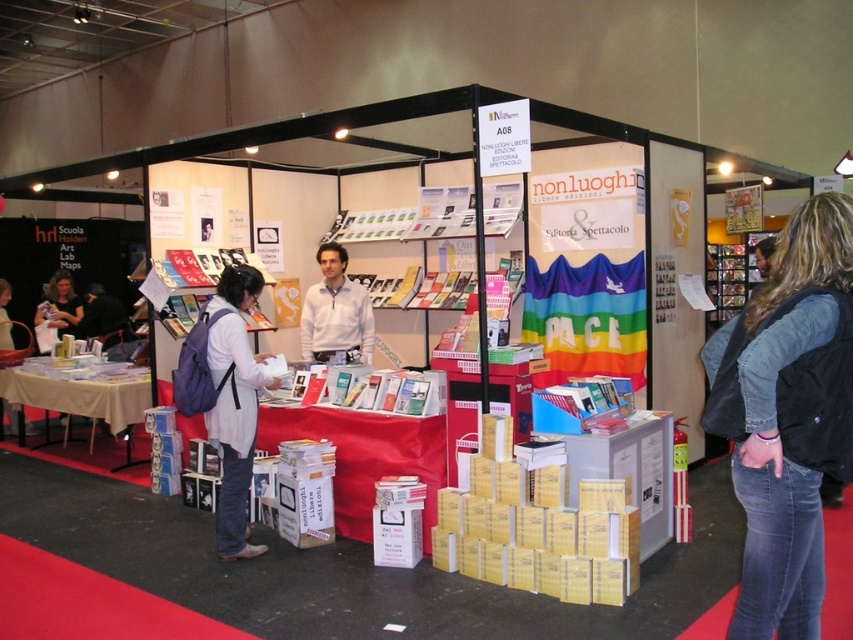
Looking at this image, you are a visitor at the book fair booth A08. You see a denim jacket at lower right and a white cotton backpack at center. Which item is physically nearer to you?

The denim jacket at lower right is closer to the viewer than the white cotton backpack at center.

Based on the photo, you are a visitor at the book fair booth A08. You notice two people wearing a white smooth shirt at center and a matte gray sweater at center. Which one is positioned more to the right side?

The white smooth shirt at center is positioned more to the right side than the matte gray sweater at center.

You are a visitor at booth A08 and want to pick up both the white cotton backpack at center and the matte white sweater at lower left. Which item should you move towards first if you are standing to the left of both objects?

You should move towards the matte white sweater at lower left first because it is on the left side of the white cotton backpack at center, so it is closer to your current position on the left.